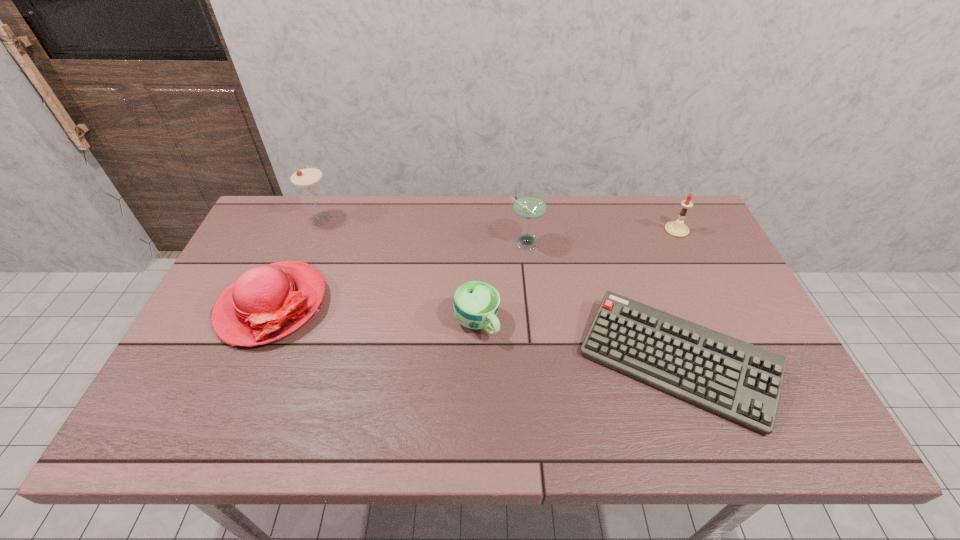
Identify the location of vacant space that satisfies the following two spatial constraints: 1. on the front side of the fourth object from right to left; 2. on the right side of the shortest object. This screenshot has height=540, width=960. (476, 362).

Where is `free location that satisfies the following two spatial constraints: 1. at the front of the computer keyboard with a bow; 2. on the right side of the fourth tallest object`? free location that satisfies the following two spatial constraints: 1. at the front of the computer keyboard with a bow; 2. on the right side of the fourth tallest object is located at coordinates (248, 362).